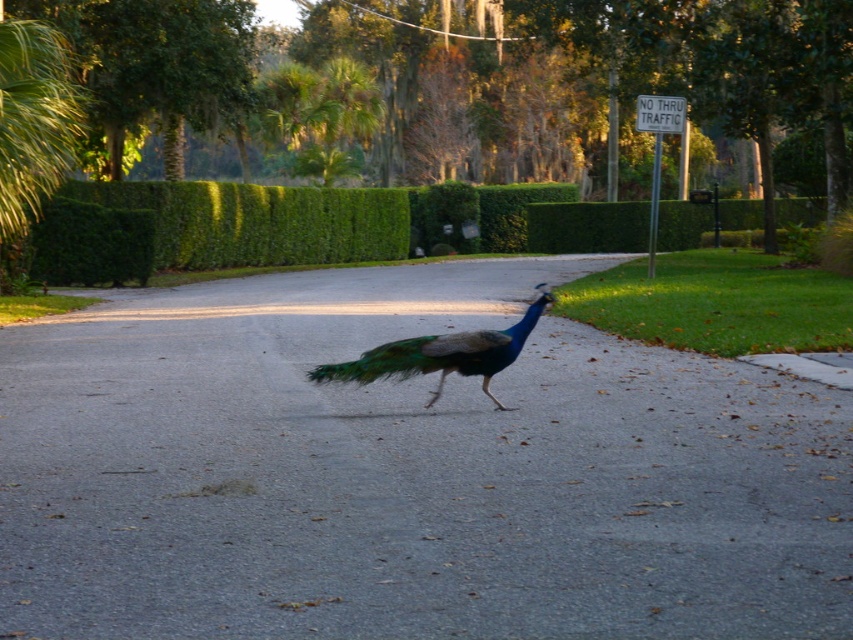
Which is behind, point (413, 589) or point (421, 339)?

Point (421, 339)

Does shiny asphalt road at center lie behind shiny blue peacock at center?

No, shiny asphalt road at center is closer to the viewer.

Where is `shiny asphalt road at center`? shiny asphalt road at center is located at coordinates (407, 472).

Where is `green leafy hedge at center`? green leafy hedge at center is located at coordinates pyautogui.click(x=309, y=225).

Does point (114, 189) come closer to viewer compared to point (445, 346)?

No, (114, 189) is behind (445, 346).

Identify the location of green leafy hedge at center. This screenshot has width=853, height=640. (309, 225).

Can you confirm if green leafy hedge at center is smaller than green iridescent tail at center?

No.

Which is in front, point (132, 205) or point (318, 365)?

Point (318, 365)

The width and height of the screenshot is (853, 640). Identify the location of green leafy hedge at center. (309, 225).